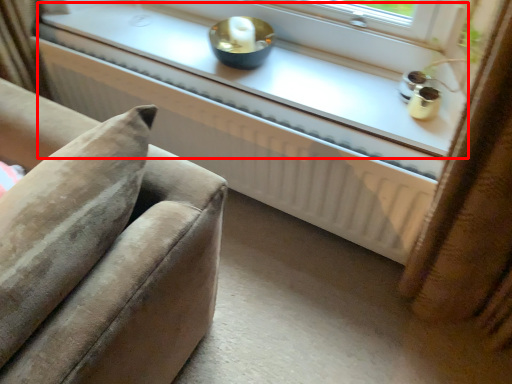
Question: From the image's perspective, what is the correct spatial positioning of window sill (annotated by the red box) in reference to radiator?

Choices:
 (A) above
 (B) below

Answer: (A)